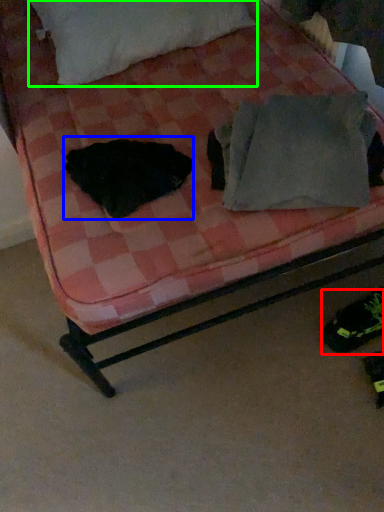
Question: Which object is positioned farthest from footwear (highlighted by a red box)? Select from animal (highlighted by a blue box) and pillow (highlighted by a green box).

Choices:
 (A) animal
 (B) pillow

Answer: (B)